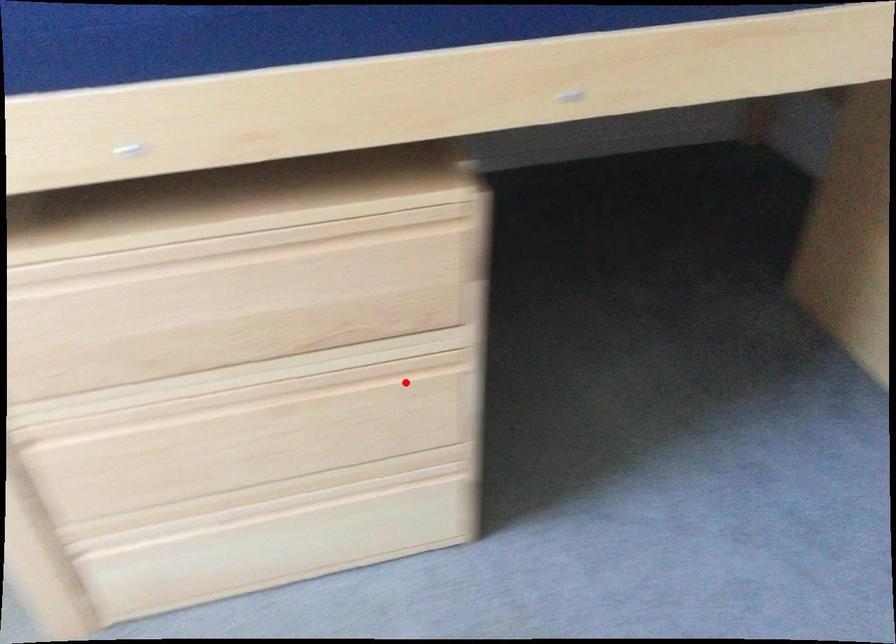
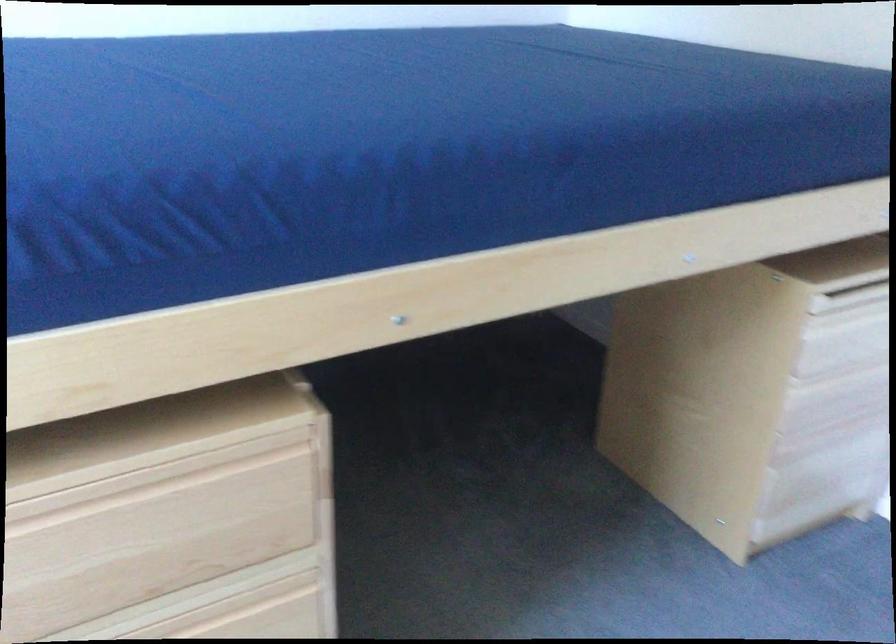
The point at the highlighted location is marked in the first image. Where is the corresponding point in the second image?

(253, 614)